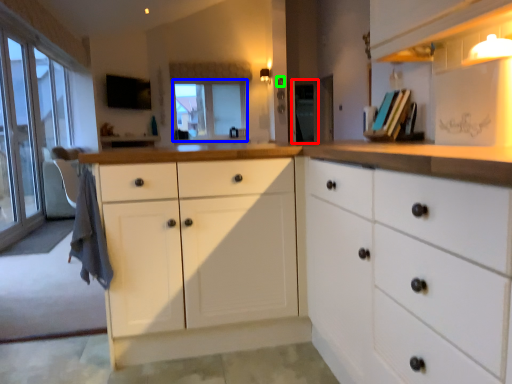
Question: Which object is the closest to the screen door (highlighted by a red box)? Choose among these: window screen (highlighted by a blue box) or knob (highlighted by a green box).

Choices:
 (A) window screen
 (B) knob

Answer: (B)